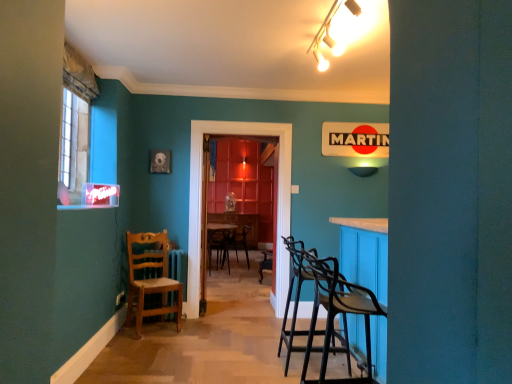
This screenshot has width=512, height=384. I want to click on free spot above matte white lampshade at upper right (from a real-world perspective), so (x=366, y=160).